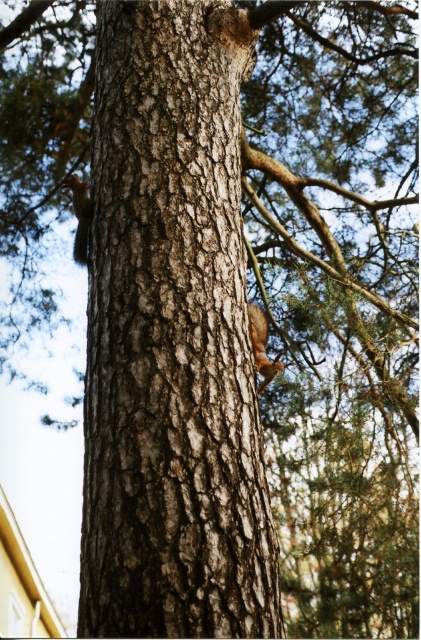
Does brown rough bark at center have a lesser height compared to brown furry squirrel at left?

Incorrect, brown rough bark at center's height does not fall short of brown furry squirrel at left's.

Between brown rough bark at center and brown furry squirrel at left, which one is positioned lower?

brown rough bark at center is below.

What are the coordinates of `brown rough bark at center` in the screenshot? It's located at (172, 339).

Does brown rough bark at center have a greater height compared to brown furry squirrel at center?

Yes, brown rough bark at center is taller than brown furry squirrel at center.

Does point (170, 572) lie in front of point (261, 387)?

Yes, it is in front of point (261, 387).

What are the coordinates of `brown rough bark at center` in the screenshot? It's located at (172, 339).

Looking at this image, who is taller, brown furry squirrel at center or brown furry squirrel at left?

brown furry squirrel at left

Is brown furry squirrel at center positioned before brown furry squirrel at left?

That is True.

Which is behind, point (258, 340) or point (77, 248)?

The point (77, 248) is behind.

The image size is (421, 640). I want to click on brown furry squirrel at center, so click(x=261, y=346).